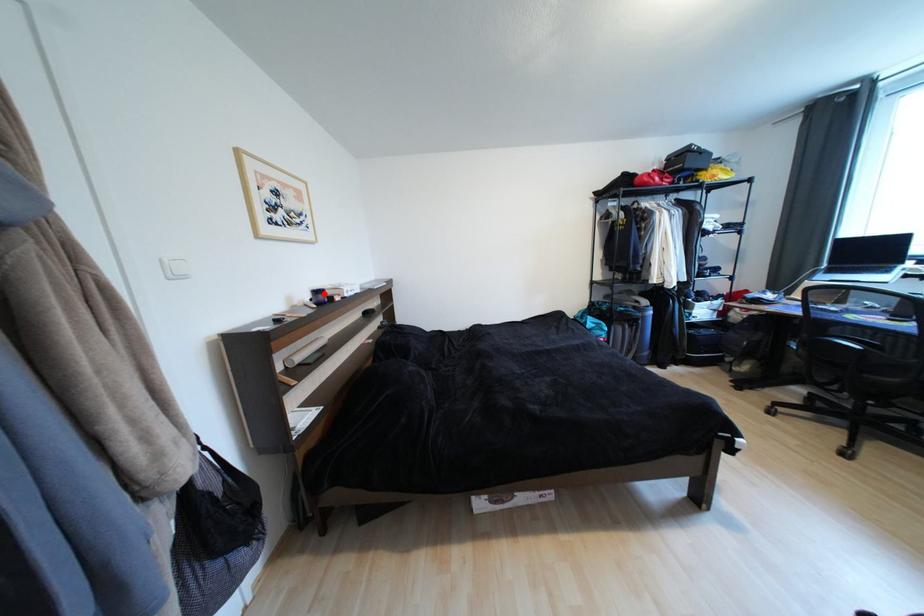
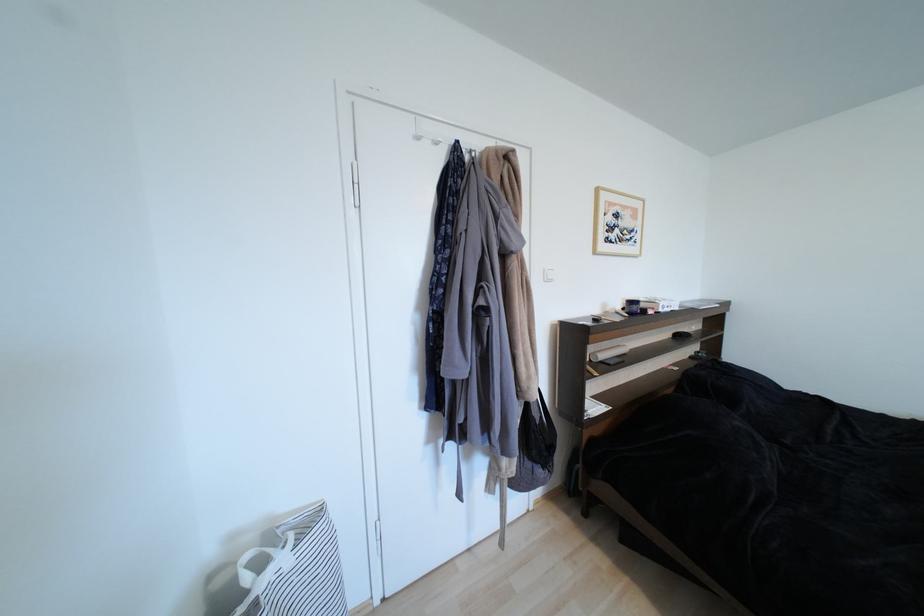
The point at the highlighted location is marked in the first image. Where is the corresponding point in the second image?

(638, 304)